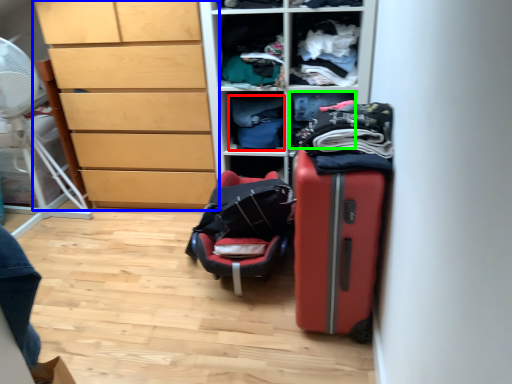
Question: Which object is positioned closest to clothing (highlighted by a red box)? Select from chest of drawers (highlighted by a blue box) and clothing (highlighted by a green box).

Choices:
 (A) chest of drawers
 (B) clothing

Answer: (B)